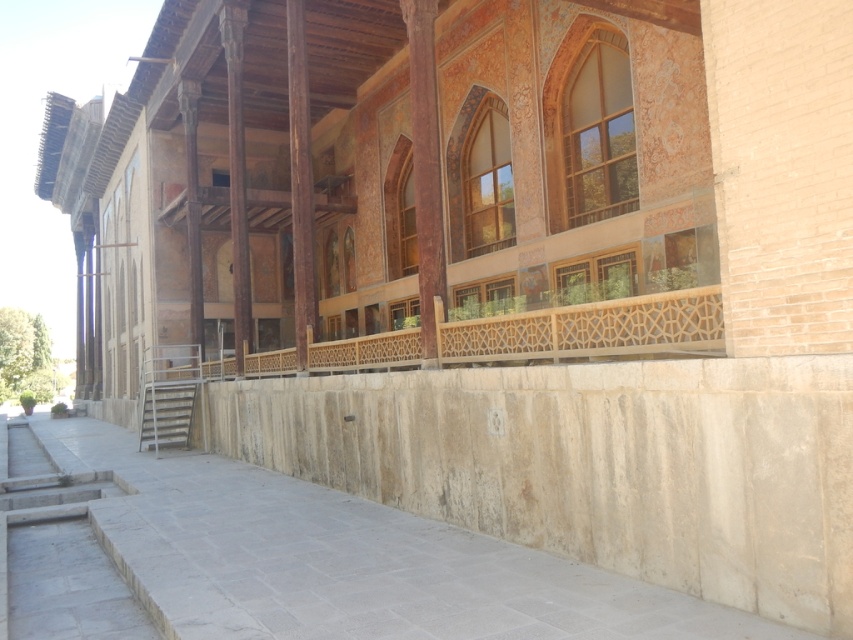
Can you confirm if wooden lattice balustrade at center is thinner than matte brown pillar at center?

No, wooden lattice balustrade at center is not thinner than matte brown pillar at center.

Is wooden lattice balustrade at center positioned in front of matte brown pillar at center?

Yes.

Is point (540, 308) more distant than point (434, 125)?

That is False.

You are a GUI agent. You are given a task and a screenshot of the screen. Output one action in this format:
    pyautogui.click(x=<x>, y=<y>)
    Task: Click on the wooden lattice balustrade at center
    The width and height of the screenshot is (853, 640).
    Given the screenshot: What is the action you would take?
    pyautogui.click(x=589, y=330)